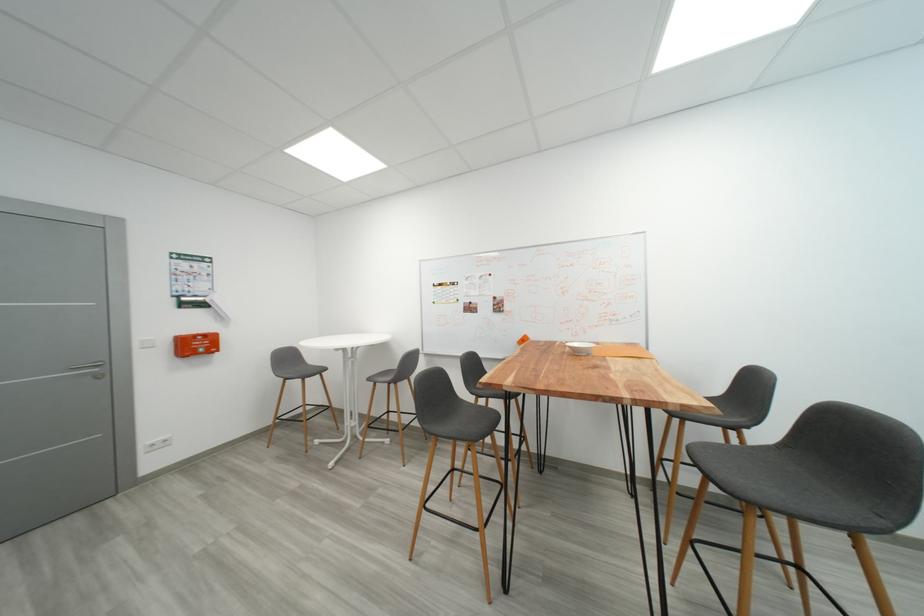
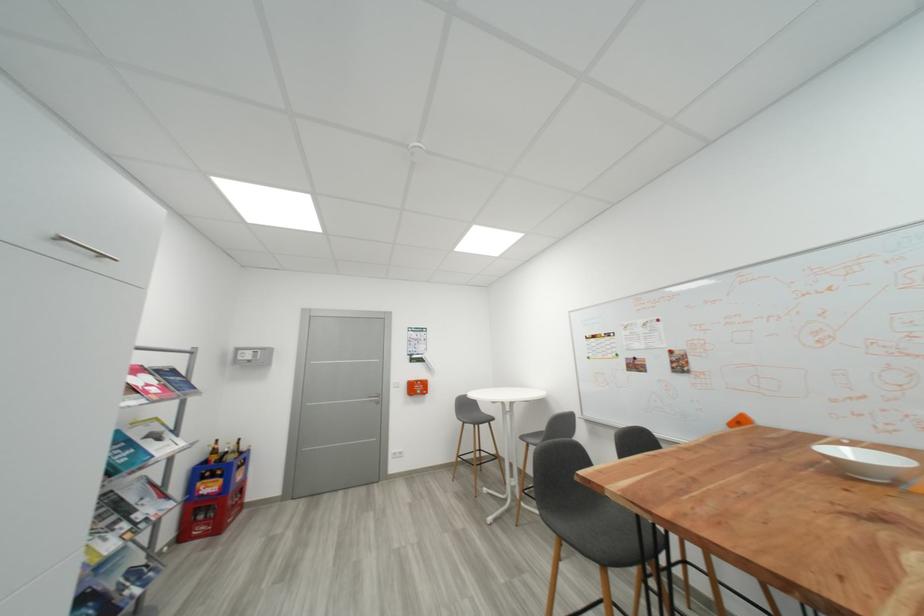
Find the pixel in the second image that matches [295,363] in the first image.

(473, 410)